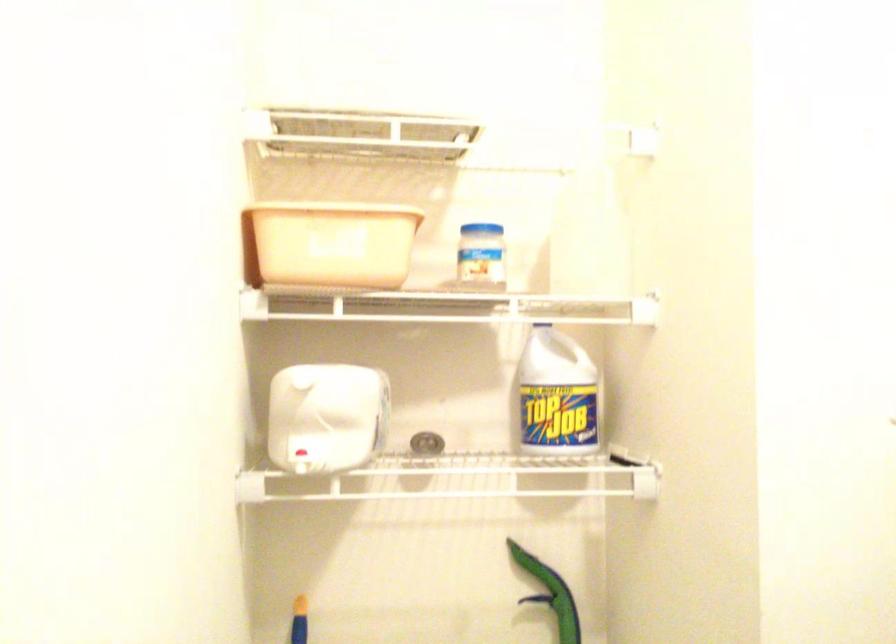
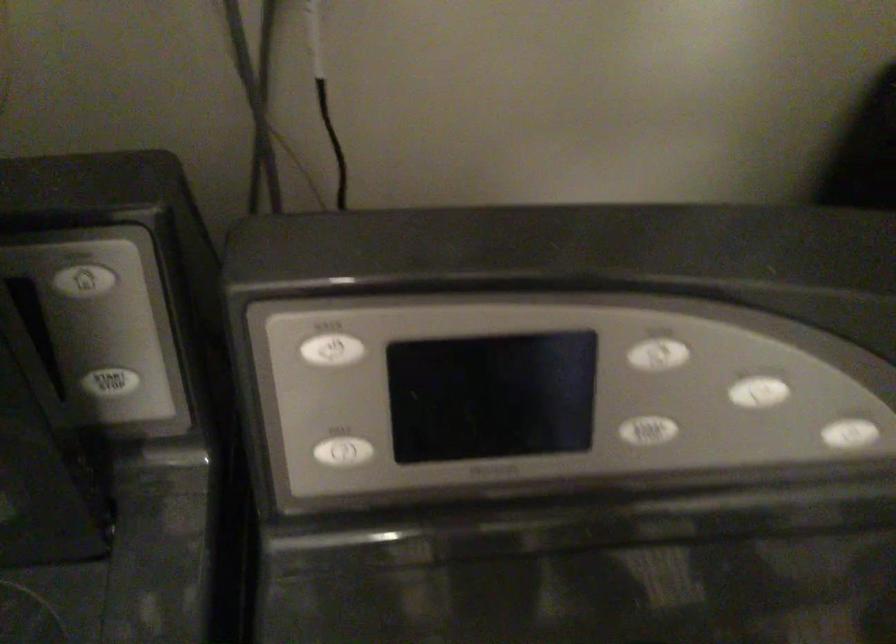
From the picture: The images are taken continuously from a first-person perspective. In which direction is your viewpoint rotating?

The rotation direction of the camera is right-down.